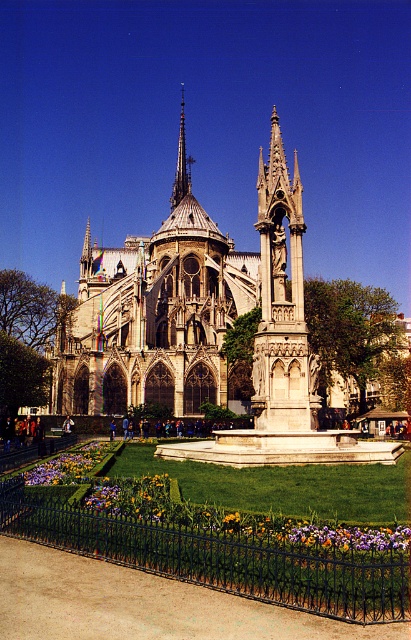
Question: Where is stone gothic cathedral at center located in relation to vibrant multicolored petals at lower center in the image?

Choices:
 (A) right
 (B) left

Answer: (A)

Question: Which of these objects is positioned closest to the vibrant multicolored petals at lower center?

Choices:
 (A) stone gothic cathedral at center
 (B) polished copper spire at center

Answer: (A)

Question: Is stone gothic cathedral at center to the right of vibrant multicolored petals at lower center from the viewer's perspective?

Choices:
 (A) yes
 (B) no

Answer: (A)

Question: Based on their relative distances, which object is nearer to the vibrant multicolored petals at lower center?

Choices:
 (A) stone gothic cathedral at center
 (B) polished copper spire at center

Answer: (A)

Question: Which object is positioned farthest from the polished copper spire at center?

Choices:
 (A) stone gothic cathedral at center
 (B) vibrant multicolored petals at lower center

Answer: (B)

Question: Does vibrant multicolored petals at lower center have a smaller size compared to polished copper spire at center?

Choices:
 (A) yes
 (B) no

Answer: (A)